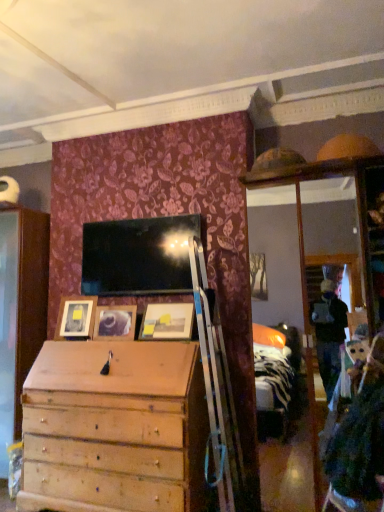
Question: Can you confirm if matte wooden picture frame at left, which is counted as the first picture frame, starting from the left, is taller than matte wooden picture frame at center, positioned as the first picture frame in right-to-left order?

Choices:
 (A) no
 (B) yes

Answer: (B)

Question: Is matte wooden picture frame at left, acting as the third picture frame starting from the right, bigger than matte wooden picture frame at center, positioned as the first picture frame in right-to-left order?

Choices:
 (A) yes
 (B) no

Answer: (B)

Question: Does matte wooden picture frame at left, which is counted as the first picture frame, starting from the left, come in front of matte wooden picture frame at center, which is the third picture frame in left-to-right order?

Choices:
 (A) no
 (B) yes

Answer: (A)

Question: From a real-world perspective, is matte wooden picture frame at left, which is counted as the first picture frame, starting from the left, on matte wooden picture frame at center, positioned as the first picture frame in right-to-left order?

Choices:
 (A) yes
 (B) no

Answer: (A)

Question: Does matte wooden picture frame at left, which is counted as the first picture frame, starting from the left, appear on the right side of matte wooden picture frame at center, which is the third picture frame in left-to-right order?

Choices:
 (A) no
 (B) yes

Answer: (A)

Question: Is matte wooden picture frame at center, which is the third picture frame in left-to-right order, wider or thinner than matte wooden picture frame at left, which is counted as the first picture frame, starting from the left?

Choices:
 (A) thin
 (B) wide

Answer: (B)

Question: Would you say matte wooden picture frame at center, which is the third picture frame in left-to-right order, is inside or outside matte wooden picture frame at left, acting as the third picture frame starting from the right?

Choices:
 (A) inside
 (B) outside

Answer: (B)

Question: Considering the relative positions of matte wooden picture frame at center, positioned as the first picture frame in right-to-left order, and matte wooden picture frame at left, acting as the third picture frame starting from the right, in the image provided, is matte wooden picture frame at center, positioned as the first picture frame in right-to-left order, to the left or to the right of matte wooden picture frame at left, acting as the third picture frame starting from the right,?

Choices:
 (A) left
 (B) right

Answer: (B)

Question: Considering the positions of point (173, 338) and point (72, 328), is point (173, 338) closer or farther from the camera than point (72, 328)?

Choices:
 (A) closer
 (B) farther

Answer: (A)

Question: From the image's perspective, is matte wooden picture frame at left, which is counted as the first picture frame, starting from the left, located above or below matte wooden picture frame at center, which is the third picture frame in left-to-right order?

Choices:
 (A) below
 (B) above

Answer: (A)

Question: Is point coord(54,338) closer or farther from the camera than point coord(148,318)?

Choices:
 (A) farther
 (B) closer

Answer: (A)

Question: Based on their sizes in the image, would you say matte wooden picture frame at left, which is counted as the first picture frame, starting from the left, is bigger or smaller than matte wooden picture frame at center, which is the third picture frame in left-to-right order?

Choices:
 (A) big
 (B) small

Answer: (B)

Question: Is matte wooden picture frame at left, which is counted as the first picture frame, starting from the left, inside or outside of matte wooden picture frame at center, positioned as the first picture frame in right-to-left order?

Choices:
 (A) inside
 (B) outside

Answer: (B)

Question: Is wooden picture frame at center, the second picture frame from the left, wider or thinner than matte wooden picture frame at left, acting as the third picture frame starting from the right?

Choices:
 (A) wide
 (B) thin

Answer: (B)

Question: In the image, is wooden picture frame at center, positioned as the 2th picture frame in right-to-left order, on the left side or the right side of matte wooden picture frame at left, acting as the third picture frame starting from the right?

Choices:
 (A) left
 (B) right

Answer: (B)